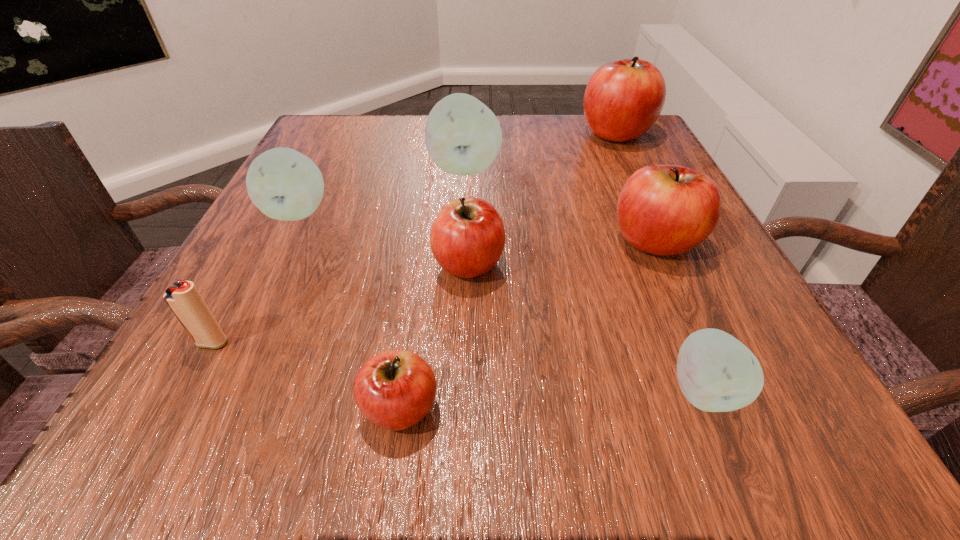
The height and width of the screenshot is (540, 960). In order to click on the biggest red apple in this screenshot , I will do `click(623, 99)`.

You are a GUI agent. You are given a task and a screenshot of the screen. Output one action in this format:
    pyautogui.click(x=<x>, y=<y>)
    Task: Click on the second white apple from right to left
    The width and height of the screenshot is (960, 540).
    Given the screenshot: What is the action you would take?
    pyautogui.click(x=463, y=136)

Image resolution: width=960 pixels, height=540 pixels. I want to click on the biggest white apple, so click(x=463, y=136).

At what (x,y) coordinates should I click in order to perform the action: click on the third smallest red apple. Please return your answer as a coordinate pair (x, y). The width and height of the screenshot is (960, 540). Looking at the image, I should click on (663, 209).

Find the location of `the second biggest white apple`. the second biggest white apple is located at coordinates pyautogui.click(x=284, y=184).

The image size is (960, 540). I want to click on the leftmost white apple, so click(284, 184).

The height and width of the screenshot is (540, 960). What are the coordinates of `the second smallest red apple` in the screenshot? It's located at (467, 239).

The image size is (960, 540). I want to click on igniter, so click(183, 298).

Identify the location of red igniter. (183, 298).

The height and width of the screenshot is (540, 960). Identify the location of the rightmost white apple. (716, 372).